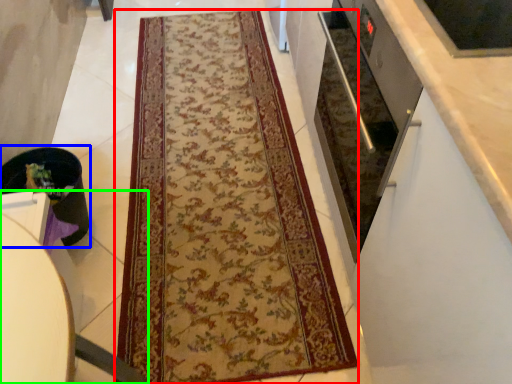
Question: Which object is the closest to the mat (highlighted by a red box)? Choose among these: appliance (highlighted by a blue box) or furniture (highlighted by a green box).

Choices:
 (A) appliance
 (B) furniture

Answer: (A)